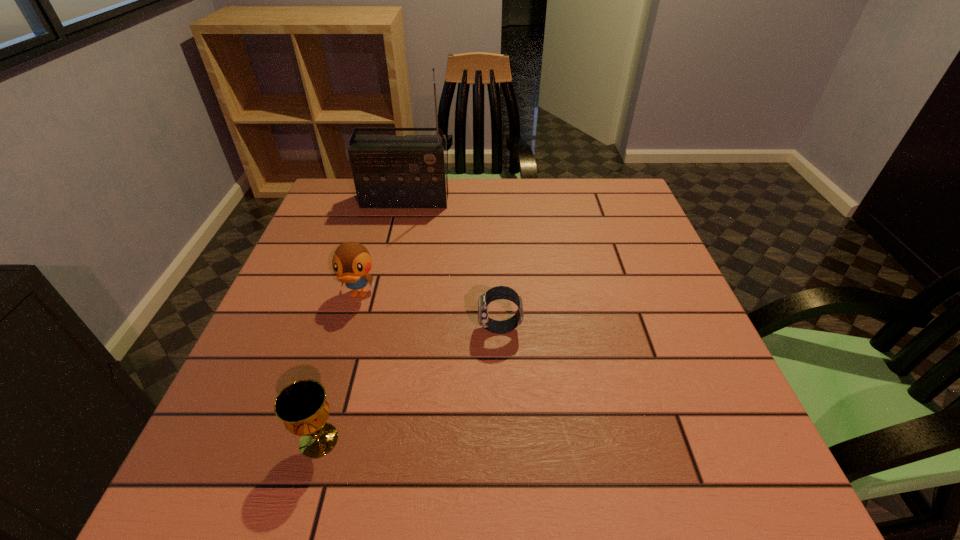
Where is `free region at the near edge of the desktop`? This screenshot has width=960, height=540. free region at the near edge of the desktop is located at coordinates (500, 467).

You are a GUI agent. You are given a task and a screenshot of the screen. Output one action in this format:
    pyautogui.click(x=<x>, y=<y>)
    Task: Click on the free spot at the left edge of the desktop
    
    Given the screenshot: What is the action you would take?
    pyautogui.click(x=316, y=300)

This screenshot has width=960, height=540. In order to click on vacant space at the right edge of the desktop in this screenshot , I will do `click(719, 376)`.

Where is `free space at the far left corner of the desktop`? The height and width of the screenshot is (540, 960). free space at the far left corner of the desktop is located at coordinates (x=323, y=199).

This screenshot has width=960, height=540. What are the coordinates of `vacant area at the far right corner` in the screenshot? It's located at (595, 185).

You are a GUI agent. You are given a task and a screenshot of the screen. Output one action in this format:
    pyautogui.click(x=<x>, y=<y>)
    Task: Click on the vacant space that's between the duck and the rightmost object
    
    Given the screenshot: What is the action you would take?
    pyautogui.click(x=429, y=312)

At what (x,y) coordinates should I click in order to perform the action: click on free area in between the duck and the tallest object. Please return your answer as a coordinate pair (x, y). Image resolution: width=960 pixels, height=540 pixels. Looking at the image, I should click on (382, 247).

The height and width of the screenshot is (540, 960). In order to click on unoccupied area between the nearest object and the rightmost object in this screenshot , I will do `click(409, 384)`.

Where is `free space between the nearest object and the farthest object`? This screenshot has height=540, width=960. free space between the nearest object and the farthest object is located at coordinates (362, 320).

Locate an element on the screen. vacant point located between the radio receiver and the duck is located at coordinates pos(382,247).